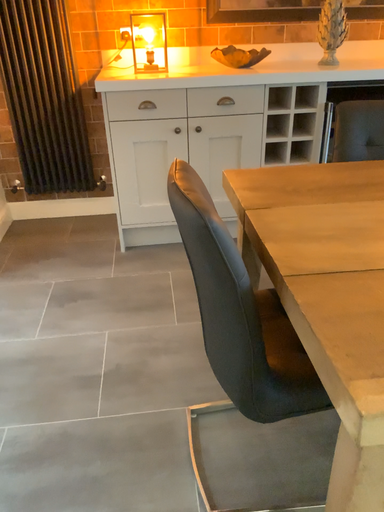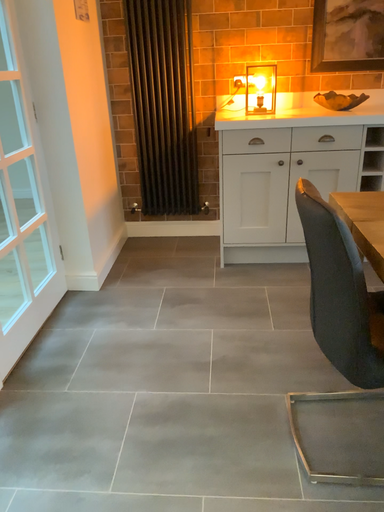
Question: How did the camera likely rotate when shooting the video?

Choices:
 (A) rotated right
 (B) rotated left

Answer: (B)